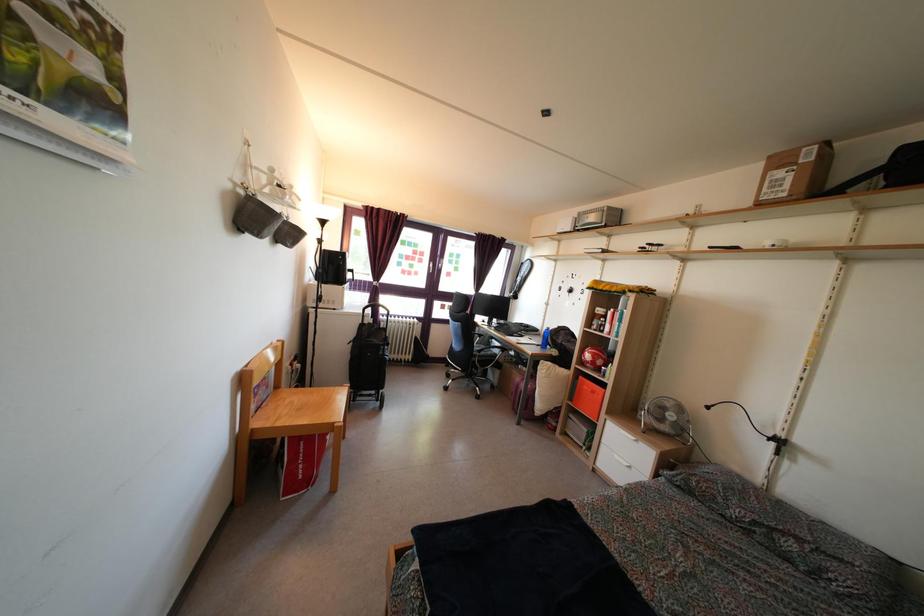
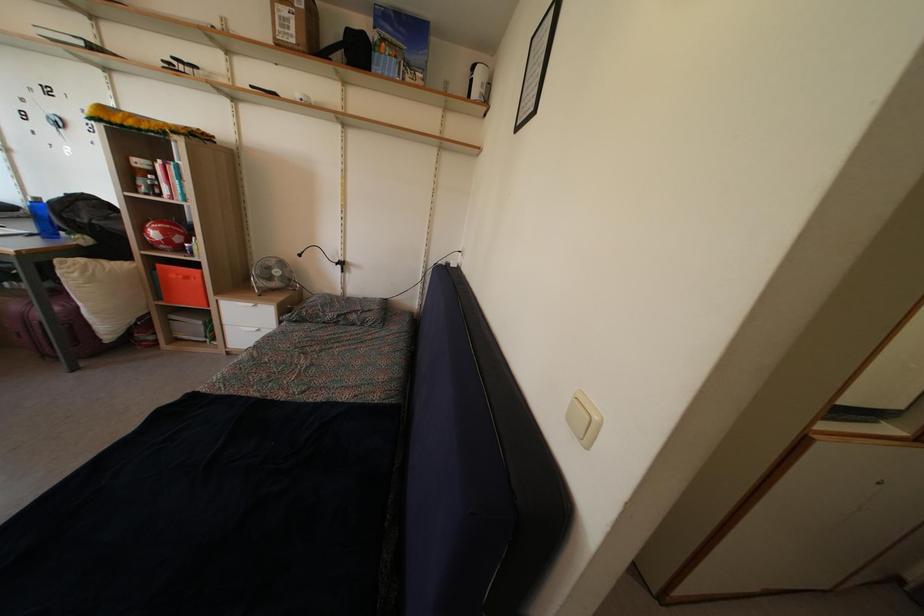
Question: I am providing you with two images of the same scene from different viewpoints. Please identify which objects are invisible in image2.

Choices:
 (A) orange storage box
 (B) blue mattress
 (C) small grey fan
 (D) none of these

Answer: (D)